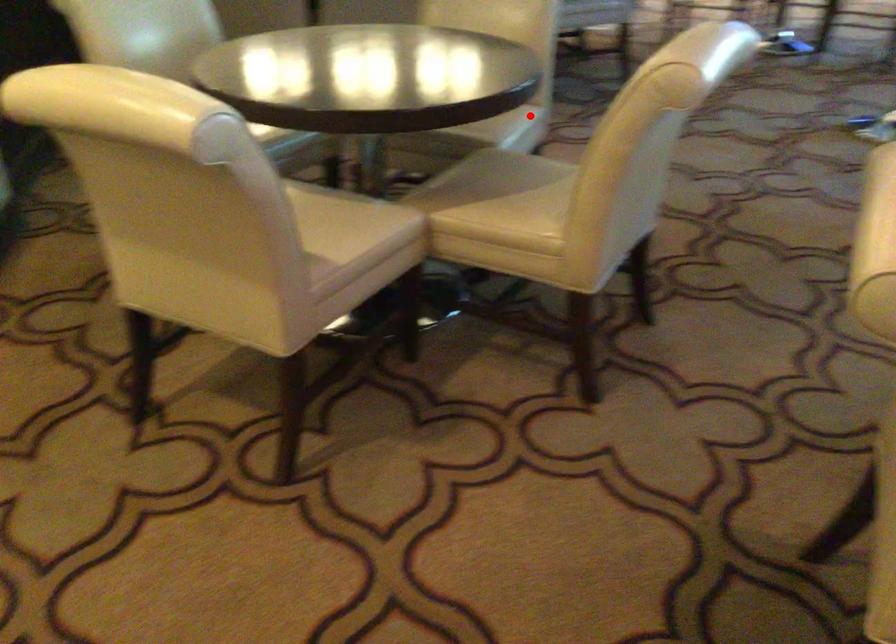
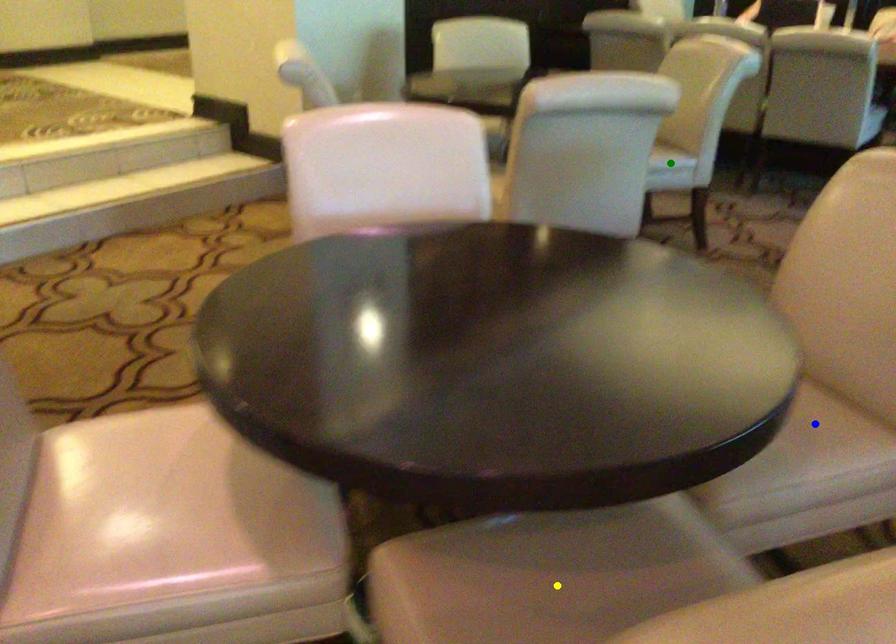
Question: I am providing you with two images of the same scene from different viewpoints. A red point is marked on the first image. You are given multiple points on the second image. Which spot in image 2 lines up with the point in image 1?

Choices:
 (A) blue point
 (B) green point
 (C) yellow point

Answer: (B)